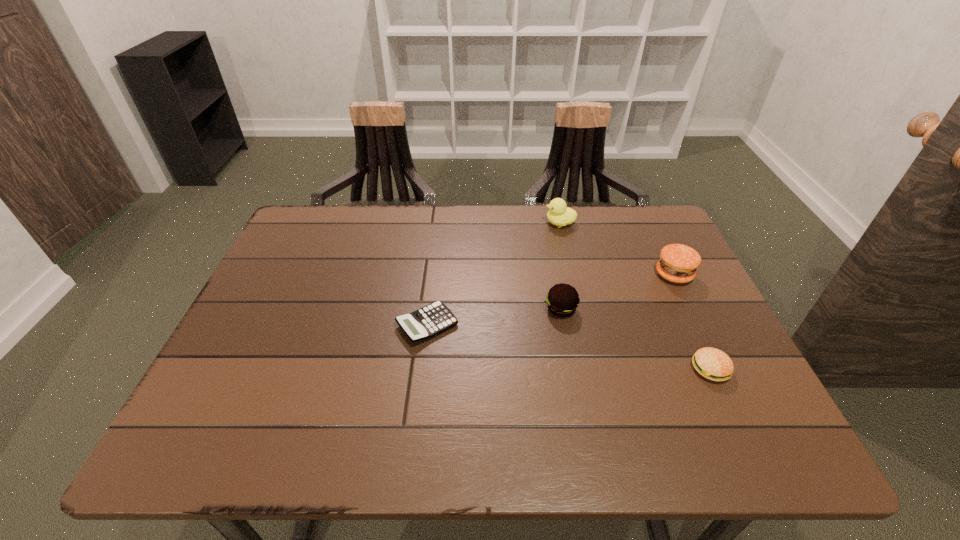
Locate an element on the screen. This screenshot has height=540, width=960. unoccupied area between the second farthest patty and the farthest object is located at coordinates (561, 266).

Find the location of a particular element. Image resolution: width=960 pixels, height=540 pixels. free space between the tallest patty and the nearest patty is located at coordinates (692, 322).

Identify the location of object that ranks as the second closest to the nearest object. This screenshot has height=540, width=960. (562, 300).

Locate which object is the second closest to the duckling. Please provide its 2D coordinates. Your answer should be formatted as a tuple, i.e. [(x, y)], where the tuple contains the x and y coordinates of a point satisfying the conditions above.

[(562, 300)]

This screenshot has height=540, width=960. Find the location of `patty that can be found as the closest to the farthest object`. patty that can be found as the closest to the farthest object is located at coordinates (678, 263).

Locate an element on the screen. This screenshot has width=960, height=540. patty that is the second closest to the calculator is located at coordinates (713, 364).

In order to click on free location that satisfies the following two spatial constraints: 1. at the beak of the duckling; 2. on the right side of the shortest patty in this screenshot , I will do `click(594, 369)`.

Where is `blank area in the image that satisfies the following two spatial constraints: 1. at the beak of the duckling; 2. on the back side of the nearest patty`? blank area in the image that satisfies the following two spatial constraints: 1. at the beak of the duckling; 2. on the back side of the nearest patty is located at coordinates (594, 369).